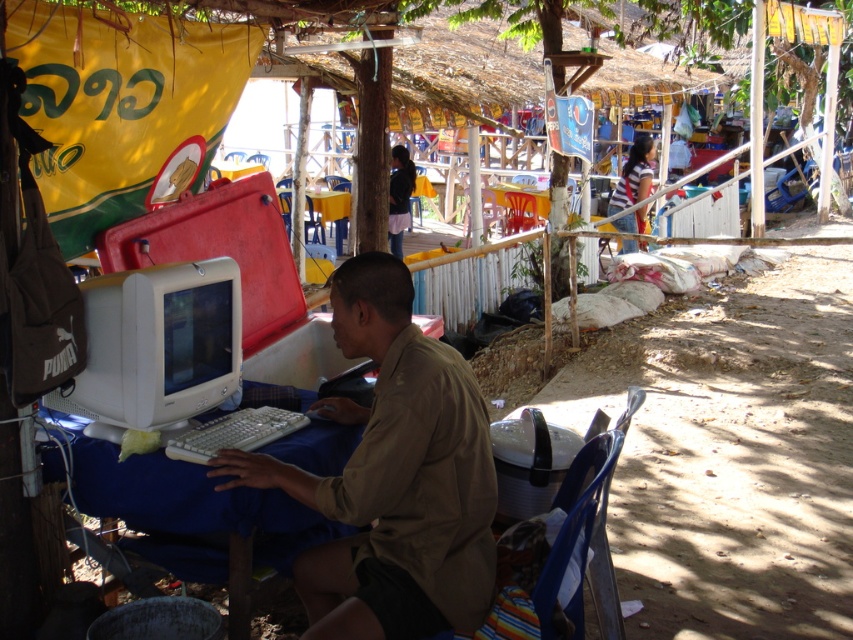
Is point (305, 595) closer to viewer compared to point (216, 502)?

No, it is behind (216, 502).

Between matte beige shirt at center and white plastic table at center, which one is positioned lower?

Positioned lower is white plastic table at center.

Which is behind, point (323, 566) or point (55, 468)?

Positioned behind is point (55, 468).

You are a GUI agent. You are given a task and a screenshot of the screen. Output one action in this format:
    pyautogui.click(x=<x>, y=<y>)
    Task: Click on the matte beige shirt at center
    
    Given the screenshot: What is the action you would take?
    pyautogui.click(x=393, y=477)